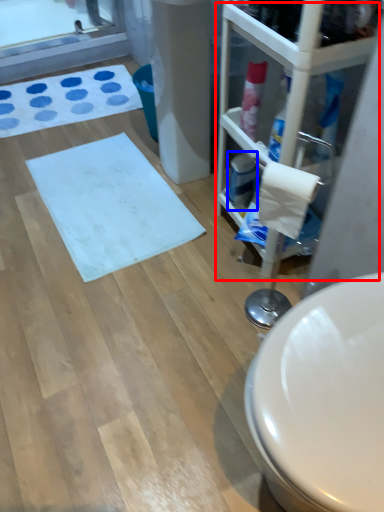
Question: Among these objects, which one is nearest to the camera, glass door (highlighted by a red box) or cleaning product (highlighted by a blue box)?

Choices:
 (A) glass door
 (B) cleaning product

Answer: (A)